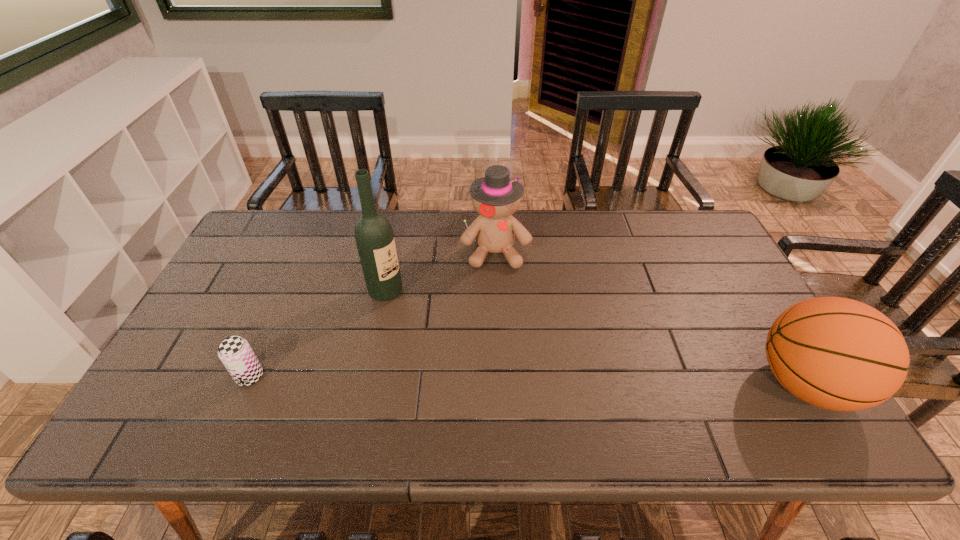
In the image, there is a desktop. At what (x,y) coordinates should I click in order to perform the action: click on vacant space at the far edge. Please return your answer as a coordinate pair (x, y). This screenshot has height=540, width=960. Looking at the image, I should click on (655, 254).

The width and height of the screenshot is (960, 540). In order to click on free space at the near edge of the desktop in this screenshot , I will do `click(554, 396)`.

You are a GUI agent. You are given a task and a screenshot of the screen. Output one action in this format:
    pyautogui.click(x=<x>, y=<y>)
    Task: Click on the vacant space at the left edge
    
    Given the screenshot: What is the action you would take?
    click(227, 336)

Where is `vacant space at the right edge of the desktop`? The image size is (960, 540). vacant space at the right edge of the desktop is located at coordinates (745, 320).

At what (x,y) coordinates should I click in order to perform the action: click on vacant area at the far left corner of the desktop. Please return your answer as a coordinate pair (x, y). The height and width of the screenshot is (540, 960). Looking at the image, I should click on (x=285, y=214).

Where is `free location at the far right corner`? free location at the far right corner is located at coordinates (688, 224).

Locate an element on the screen. vacant space in between the basketball and the leftmost object is located at coordinates (527, 380).

Locate an element on the screen. free area in between the rightmost object and the rag_doll is located at coordinates (650, 318).

The width and height of the screenshot is (960, 540). In order to click on free space between the second object from left to right and the rightmost object in this screenshot , I will do `click(595, 338)`.

Identify the location of vacant space that's between the farthest object and the beer can. The width and height of the screenshot is (960, 540). click(372, 314).